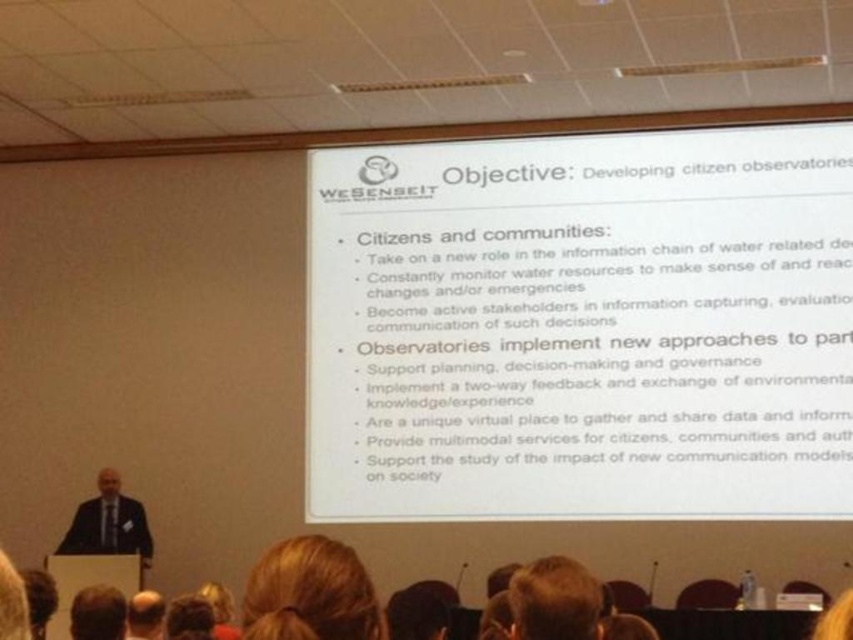
You are an attendee at the presentation and want to focus on the slide. Which of the two points, point (125, 515) or point (199, 605), is closer to the bottom of the slide?

Point (199, 605) is closer to the bottom of the slide because its y coordinate is higher than point (125, 515).

You are an attendee at this presentation and need to take notes. The white paper at center is on the table, and the brown hair at lower left belongs to the presenter. Which object is wider when viewed from your seat?

The white paper at center is wider than the brown hair at lower left.

You are an attendee at this presentation. You notice two people in the room. One is wearing a dark suit at lower left and the other has brown hair at upper center. From your perspective, which person is standing to the left of the other?

The dark suit at lower left is positioned on the left side of brown hair at upper center, so the person in the dark suit at lower left is to the left of the person with brown hair at upper center.